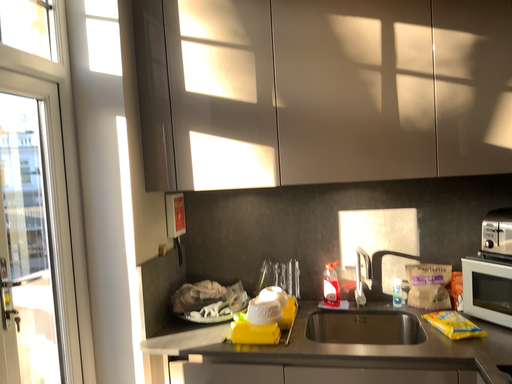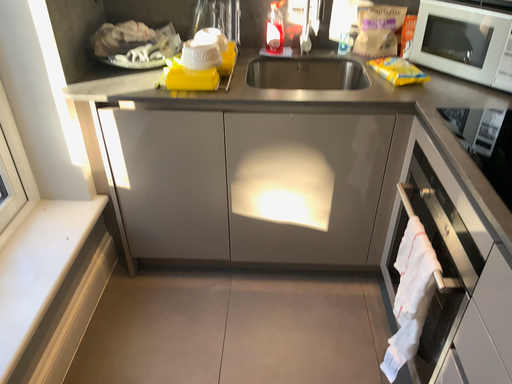
Question: How did the camera likely rotate when shooting the video?

Choices:
 (A) rotated left
 (B) rotated right

Answer: (B)